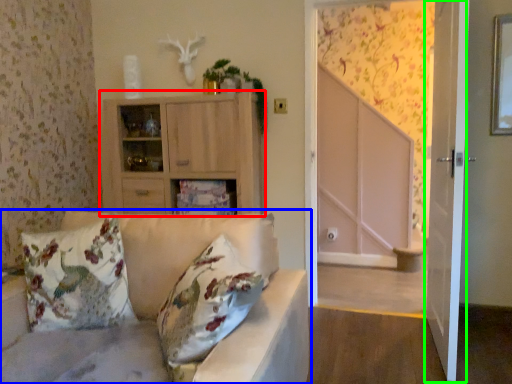
Question: Based on their relative distances, which object is nearer to cabinetry (highlighted by a red box)? Choose from studio couch (highlighted by a blue box) and screen door (highlighted by a green box).

Choices:
 (A) studio couch
 (B) screen door

Answer: (A)